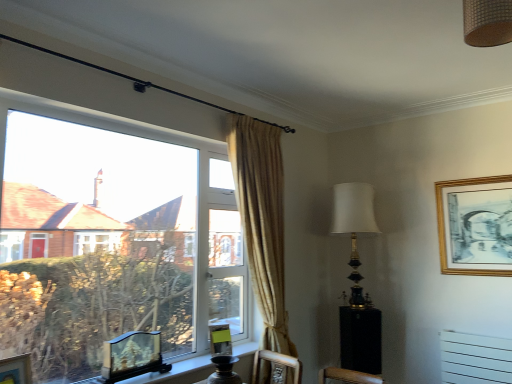
The height and width of the screenshot is (384, 512). I want to click on free space above gold/gilded picture frame at upper right, which is the first picture frame in back-to-front order (from a real-world perspective), so click(x=474, y=172).